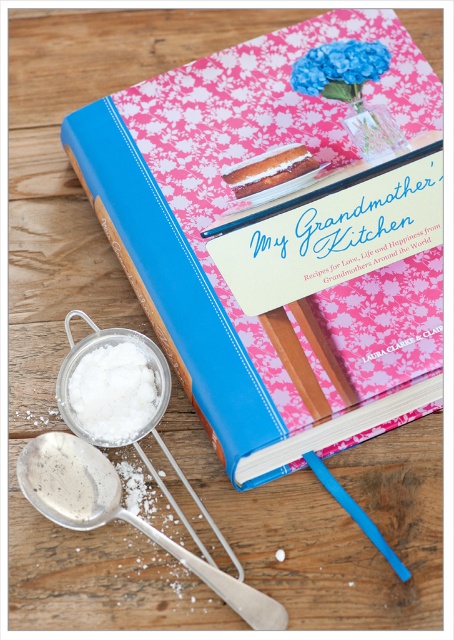
Which of these two, blue hardcover book at center or silver metallic spoon at lower left, stands taller?

blue hardcover book at center is taller.

Does blue hardcover book at center appear under silver metallic spoon at lower left?

Incorrect, blue hardcover book at center is not positioned below silver metallic spoon at lower left.

Between point (205, 369) and point (227, 596), which one is positioned in front?

Point (227, 596) is more forward.

Locate an element on the screen. blue hardcover book at center is located at coordinates (238, 204).

Does blue hardcover book at center appear on the left side of blue fabric flower at upper center?

Yes, blue hardcover book at center is to the left of blue fabric flower at upper center.

The height and width of the screenshot is (640, 454). Describe the element at coordinates (238, 204) in the screenshot. I see `blue hardcover book at center` at that location.

Image resolution: width=454 pixels, height=640 pixels. Describe the element at coordinates (238, 204) in the screenshot. I see `blue hardcover book at center` at that location.

This screenshot has width=454, height=640. Identify the location of blue hardcover book at center. (238, 204).

Who is higher up, white powdery substance at lower left or blue fabric flower at upper center?

Positioned higher is blue fabric flower at upper center.

Consider the image. Is white powdery substance at lower left to the left of blue fabric flower at upper center from the viewer's perspective?

Yes, white powdery substance at lower left is to the left of blue fabric flower at upper center.

Is point (93, 355) closer to camera compared to point (324, 56)?

Yes, it is.

This screenshot has height=640, width=454. Identify the location of white powdery substance at lower left. (113, 392).